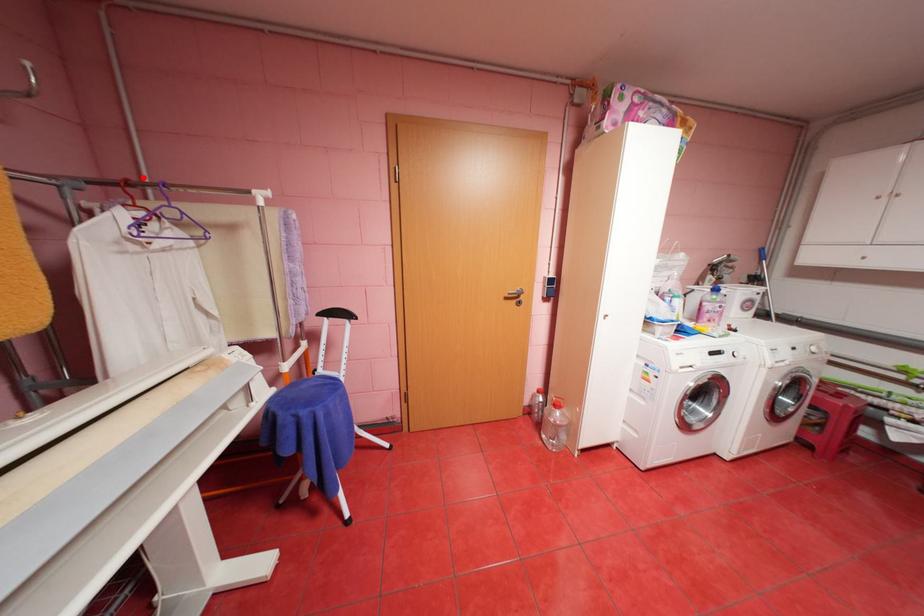
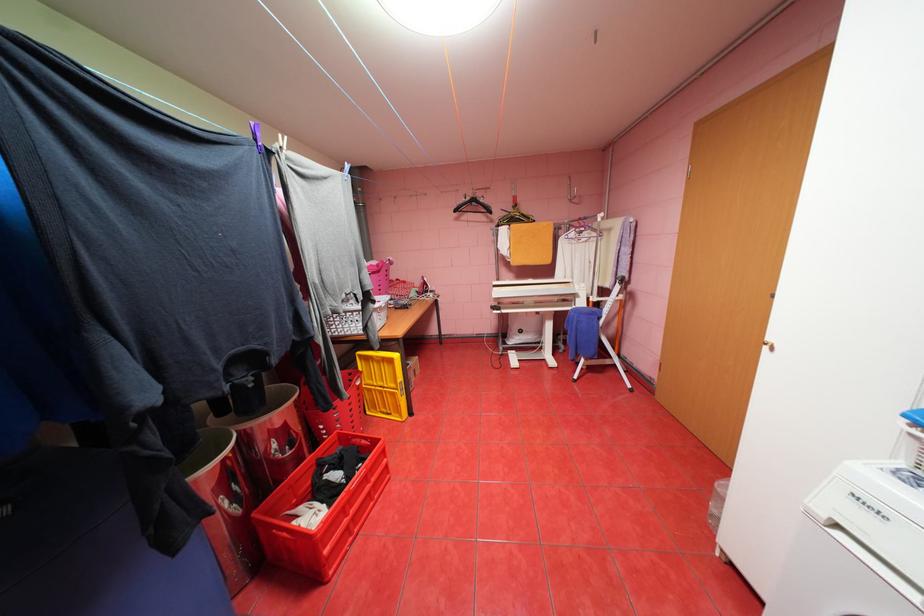
Question: I am providing you with two images of the same scene from different viewpoints. A red point is shown in image1. For the corresponding object point in image2, is it positioned nearer or farther from the camera?

Choices:
 (A) Nearer
 (B) Farther

Answer: (A)